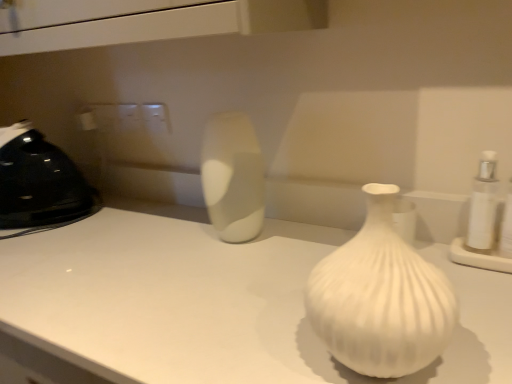
The image size is (512, 384). In order to click on free spot to the left of white ribbed vase at center, the first vase viewed from the front in this screenshot , I will do `click(240, 335)`.